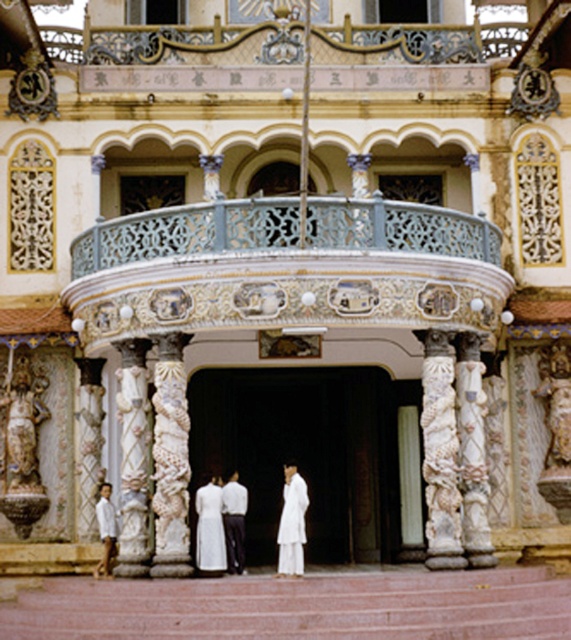
Question: Which object is the closest to the white cotton dress at center?

Choices:
 (A) white silk dress at center
 (B) carved stone statue at center

Answer: (A)

Question: Can you confirm if white cotton dress at center is positioned below white cotton shirt at lower left?

Choices:
 (A) no
 (B) yes

Answer: (A)

Question: Which of these objects is positioned closest to the white cotton shirt at lower left?

Choices:
 (A) carved stone statue at center
 (B) reddish-brown stone stairs at center
 (C) white satin dress at center

Answer: (C)

Question: Which of the following is the farthest from the observer?

Choices:
 (A) reddish-brown stone stairs at center
 (B) white cotton shirt at lower left

Answer: (B)

Question: Does reddish-brown stone stairs at center appear over carved stone statue at center?

Choices:
 (A) yes
 (B) no

Answer: (B)

Question: Is carved stone statue at center thinner than white cotton shirt at lower left?

Choices:
 (A) yes
 (B) no

Answer: (B)